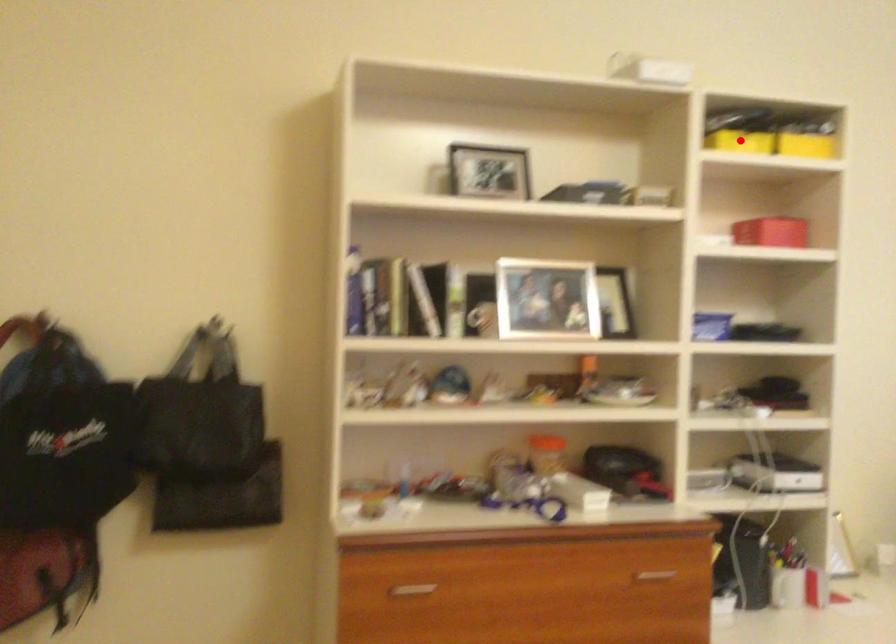
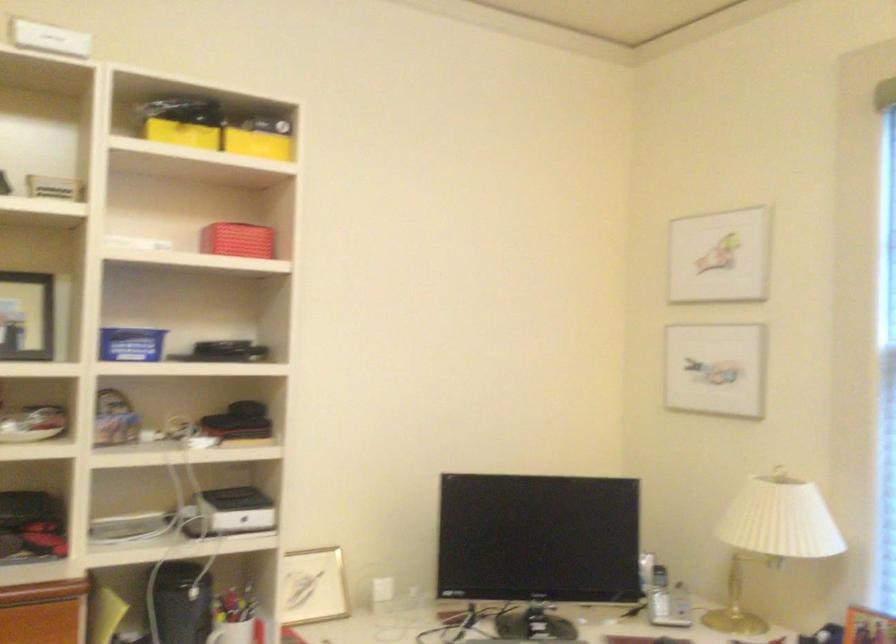
In the second image, find the point that corresponds to the highlighted location in the first image.

(182, 134)